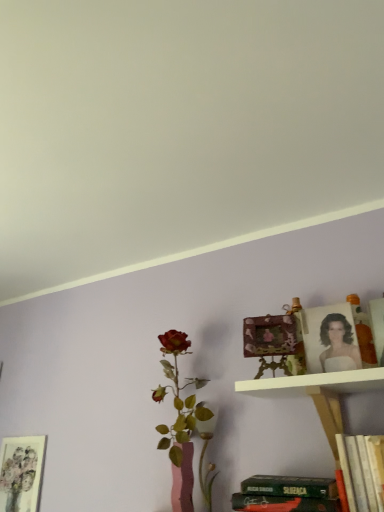
Question: Considering the relative sizes of matte gold picture frame at upper right, positioned as the 3th picture frame in left-to-right order, and matte floral print at lower left, placed as the 3th picture frame when sorted from right to left, in the image provided, is matte gold picture frame at upper right, positioned as the 3th picture frame in left-to-right order, taller than matte floral print at lower left, placed as the 3th picture frame when sorted from right to left,?

Choices:
 (A) no
 (B) yes

Answer: (A)

Question: Can you confirm if matte gold picture frame at upper right, arranged as the first picture frame when viewed from the top, is smaller than matte floral print at lower left, placed as the 3th picture frame when sorted from right to left?

Choices:
 (A) yes
 (B) no

Answer: (A)

Question: Is matte gold picture frame at upper right, positioned as the 3th picture frame in left-to-right order, facing away from matte floral print at lower left, which is counted as the third picture frame, starting from the front?

Choices:
 (A) no
 (B) yes

Answer: (A)

Question: Does matte gold picture frame at upper right, arranged as the first picture frame when viewed from the top, have a lesser height compared to matte floral print at lower left, positioned as the first picture frame in bottom-to-top order?

Choices:
 (A) no
 (B) yes

Answer: (B)

Question: Can you confirm if matte gold picture frame at upper right, placed as the third picture frame when sorted from back to front, is bigger than matte floral print at lower left, placed as the 3th picture frame when sorted from right to left?

Choices:
 (A) yes
 (B) no

Answer: (B)

Question: From a real-world perspective, is matte gold picture frame at upper right, placed as the third picture frame when sorted from back to front, located higher than matte floral print at lower left, placed as the 3th picture frame when sorted from right to left?

Choices:
 (A) yes
 (B) no

Answer: (A)

Question: From a real-world perspective, is matte floral print at lower left, which is counted as the 1th picture frame, starting from the left, located beneath wooden carved frame at upper right, arranged as the 2th picture frame when ordered from the bottom?

Choices:
 (A) no
 (B) yes

Answer: (B)

Question: Is matte floral print at lower left, which is counted as the third picture frame, starting from the front, to the right of wooden carved frame at upper right, arranged as the 2th picture frame when ordered from the bottom, from the viewer's perspective?

Choices:
 (A) yes
 (B) no

Answer: (B)

Question: Could wooden carved frame at upper right, which is counted as the second picture frame, starting from the top, be considered to be inside matte floral print at lower left, which is counted as the 1th picture frame, starting from the left?

Choices:
 (A) yes
 (B) no

Answer: (B)

Question: From the image's perspective, is matte floral print at lower left, positioned as the first picture frame in bottom-to-top order, located beneath wooden carved frame at upper right, arranged as the 2th picture frame when ordered from the bottom?

Choices:
 (A) no
 (B) yes

Answer: (B)

Question: Can you confirm if matte floral print at lower left, which is counted as the third picture frame, starting from the front, is smaller than wooden carved frame at upper right, which is the 2th picture frame from front to back?

Choices:
 (A) yes
 (B) no

Answer: (A)

Question: Is matte floral print at lower left, placed as the 3th picture frame when sorted from right to left, in front of wooden carved frame at upper right, which is the second picture frame in left-to-right order?

Choices:
 (A) no
 (B) yes

Answer: (A)

Question: Can you confirm if matte floral print at lower left, placed as the 3th picture frame when sorted from right to left, is shorter than white wooden shelf at upper center?

Choices:
 (A) yes
 (B) no

Answer: (B)